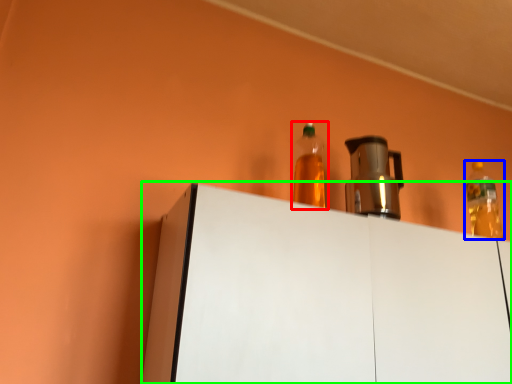
Question: Which object is positioned closest to bottle (highlighted by a red box)? Select from bottle (highlighted by a blue box) and furniture (highlighted by a green box).

Choices:
 (A) bottle
 (B) furniture

Answer: (B)